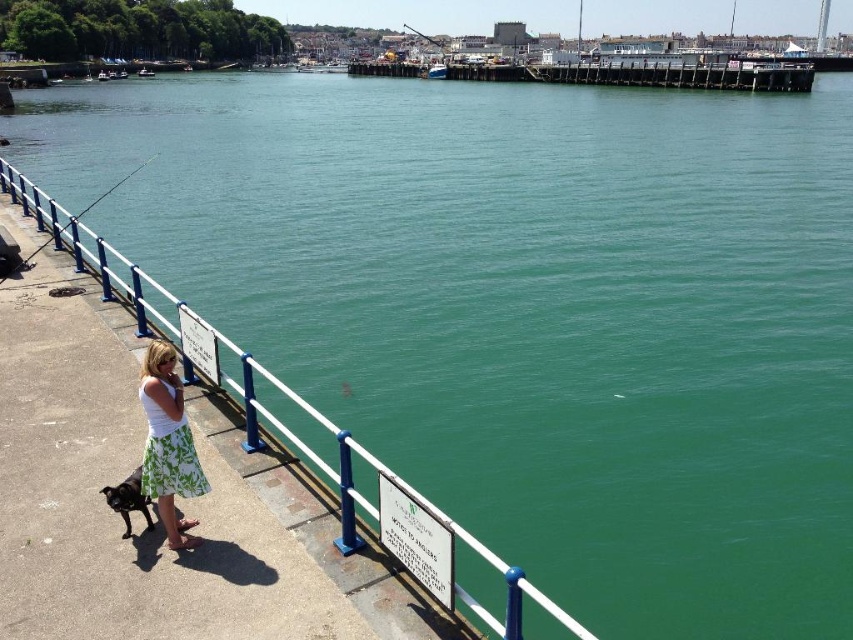
You are a photographer trying to capture the scene from the water level. Which object, the green floral skirt at lower left or the metallic fishing pole at upper center, would appear larger in your photo?

The green floral skirt at lower left appears larger because it is closer to the viewer than the metallic fishing pole at upper center.

Looking at this image, you are standing on the walkway and want to take a photo of both the green floral skirt at lower left and the black glossy dog at lower left. Which one should you focus on first to ensure both are in frame?

Since the green floral skirt at lower left is located above the black glossy dog at lower left, you should focus on the green floral skirt at lower left first to ensure both are in frame.